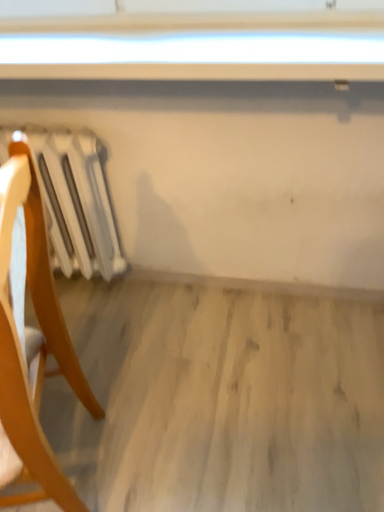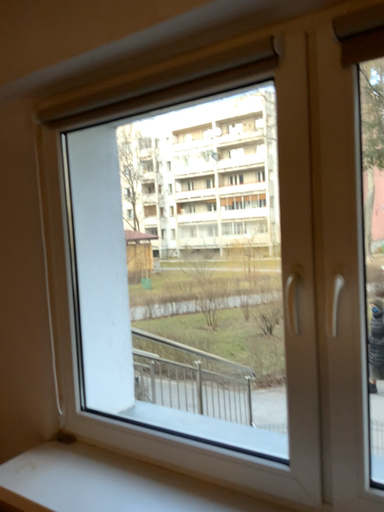
Question: How did the camera likely rotate when shooting the video?

Choices:
 (A) rotated downward
 (B) rotated upward

Answer: (B)